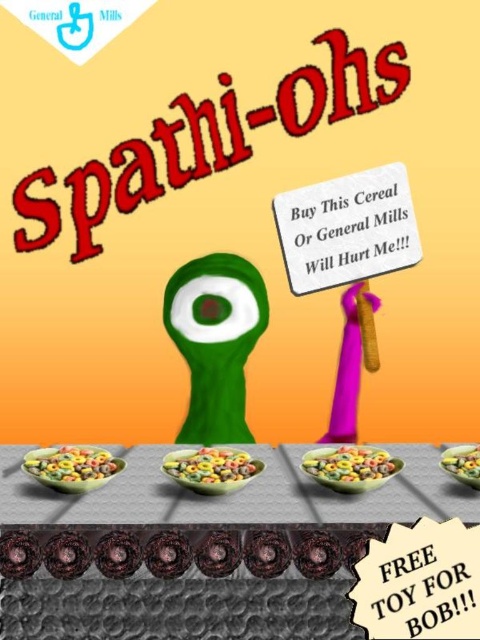
Can you confirm if multicolored glossy cereal bowl at center is wider than multicolored cereal at center?

Indeed, multicolored glossy cereal bowl at center has a greater width compared to multicolored cereal at center.

Between point (261, 465) and point (380, 468), which one is positioned in front?

Point (380, 468) is more forward.

Is point (220, 458) closer to viewer compared to point (336, 460)?

That is False.

You are a GUI agent. You are given a task and a screenshot of the screen. Output one action in this format:
    pyautogui.click(x=<x>, y=<y>)
    Task: Click on the multicolored glossy cereal bowl at center
    
    Given the screenshot: What is the action you would take?
    pyautogui.click(x=211, y=467)

Can you confirm if white paper sign at center is taller than smooth plastic bowl at center?

Yes.

The height and width of the screenshot is (640, 480). What are the coordinates of `white paper sign at center` in the screenshot? It's located at (347, 228).

Is white paper sign at center closer to camera compared to colorful cereal at lower left?

No, it is behind colorful cereal at lower left.

Is white paper sign at center to the right of colorful cereal at lower left from the viewer's perspective?

Indeed, white paper sign at center is positioned on the right side of colorful cereal at lower left.

Between point (305, 198) and point (47, 480), which one is positioned behind?

Point (305, 198)

I want to click on white paper sign at center, so pyautogui.click(x=347, y=228).